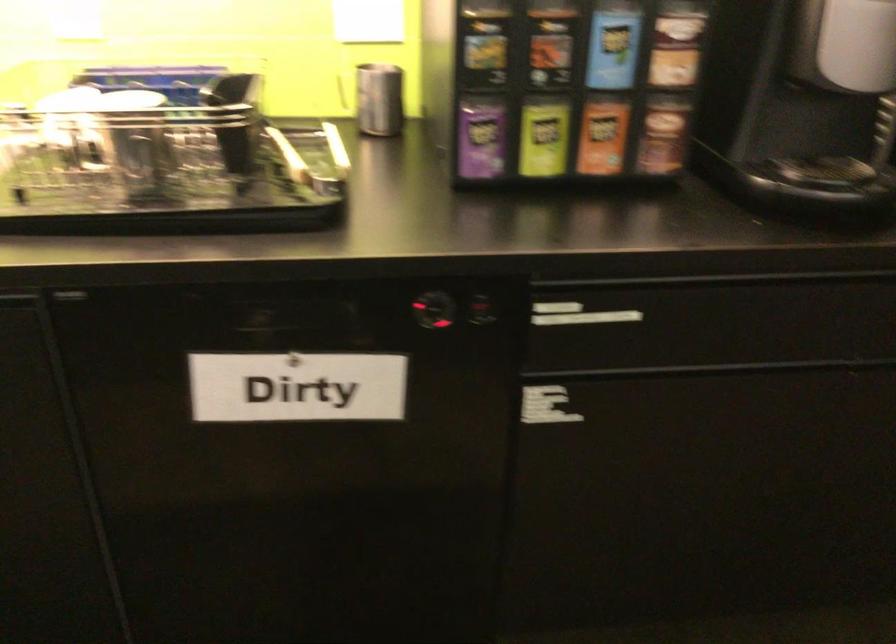
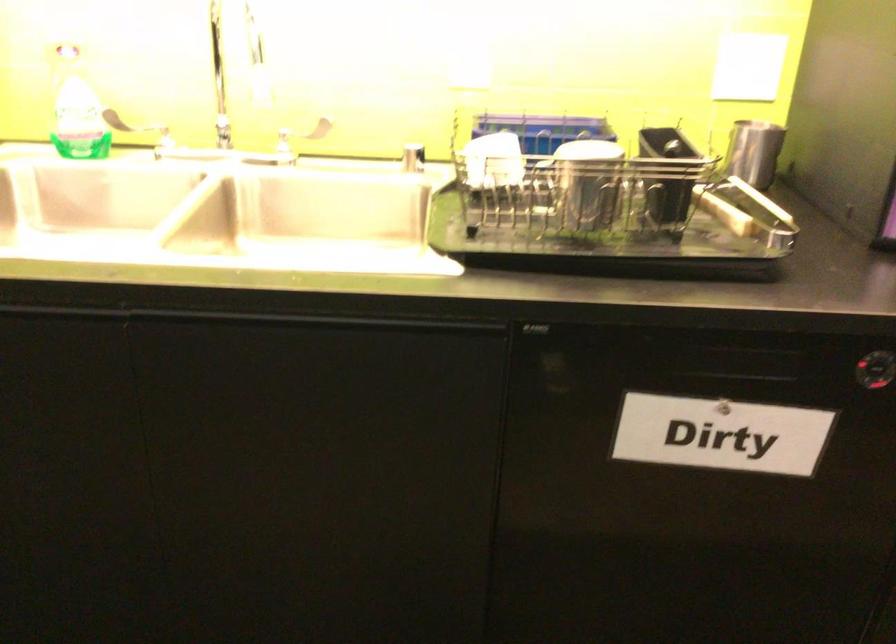
Question: In a continuous first-person perspective shot, in which direction is the camera moving?

Choices:
 (A) Left
 (B) Right
 (C) Forward
 (D) Backward

Answer: (A)